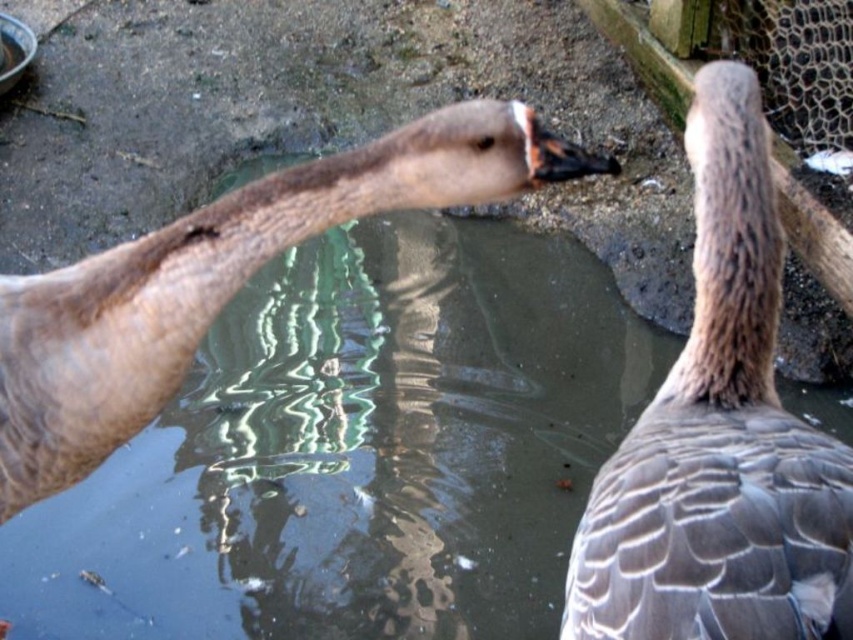
Question: Observing the image, what is the correct spatial positioning of gray feathered duck at center in reference to brown feathered duck at left?

Choices:
 (A) above
 (B) below

Answer: (B)

Question: Does gray feathered duck at center appear on the left side of brown feathered duck at left?

Choices:
 (A) yes
 (B) no

Answer: (B)

Question: Which object is closer to the camera taking this photo?

Choices:
 (A) gray feathered duck at center
 (B) brown feathered duck at left

Answer: (A)

Question: Can you confirm if gray feathered duck at center is positioned to the left of brown feathered duck at left?

Choices:
 (A) no
 (B) yes

Answer: (A)

Question: Which point is closer to the camera?

Choices:
 (A) (457, 108)
 (B) (834, 504)

Answer: (B)